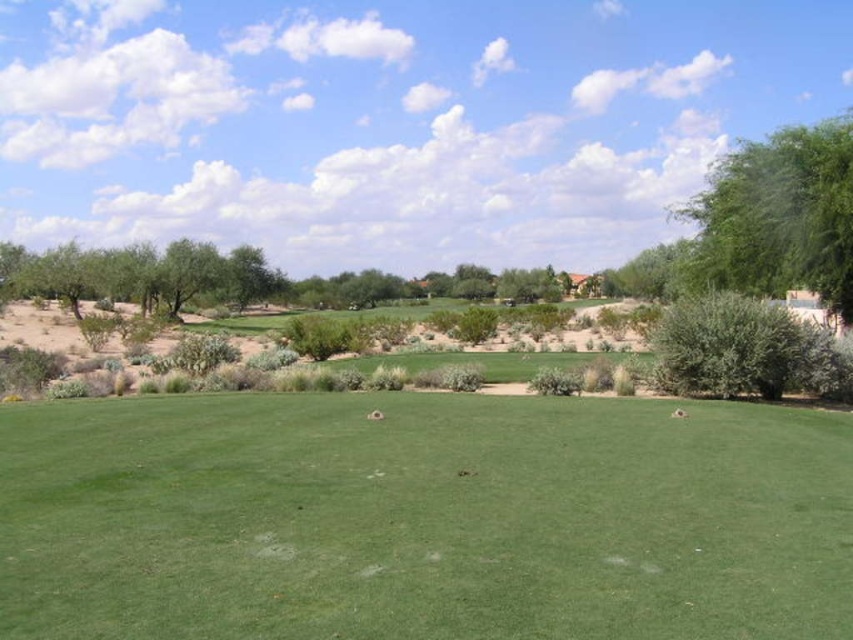
You are a landscape architect planning to install a new water feature between the green leafy tree at upper right and the green leafy tree at center. Given that the water feature requires a minimum of 50 meters of space between the two trees to be installed safely, can you confirm if the current distance allows for this installation?

The distance between the green leafy tree at upper right and the green leafy tree at center is 62.44 meters, which exceeds the required 50 meters. Therefore, the water feature can be safely installed between them.

You are standing at the center of the green grassy field in the foreground of the image. You see a point marked at coordinates (778, 216). What object does this point correspond to?

The point at coordinates (778, 216) corresponds to the green leafy tree at upper right.

In the scene shown: You are a golfer standing on the green grassy field in the foreground. You want to hit a ball towards the green leafy tree at upper right. However, there is also the green leafy tree at left in your path. Which tree should you aim around to avoid hitting the ball into either tree?

The green leafy tree at upper right is larger in size than the green leafy tree at left, so you should aim around the larger tree to avoid hitting the ball into it.